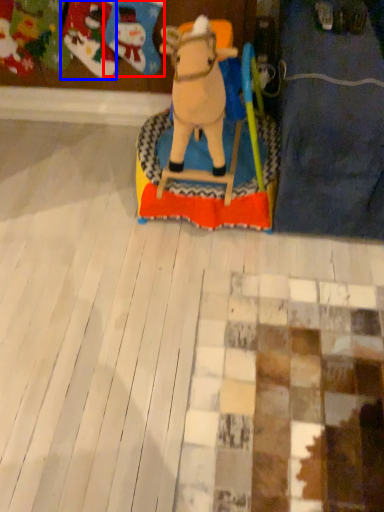
Question: Which of the following is the farthest to the observer, toy (highlighted by a red box) or toy (highlighted by a blue box)?

Choices:
 (A) toy
 (B) toy

Answer: (B)